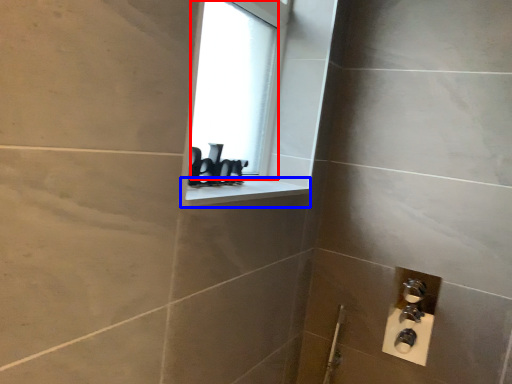
Question: Which of the following is the farthest to the observer, window screen (highlighted by a red box) or window sill (highlighted by a blue box)?

Choices:
 (A) window screen
 (B) window sill

Answer: (A)